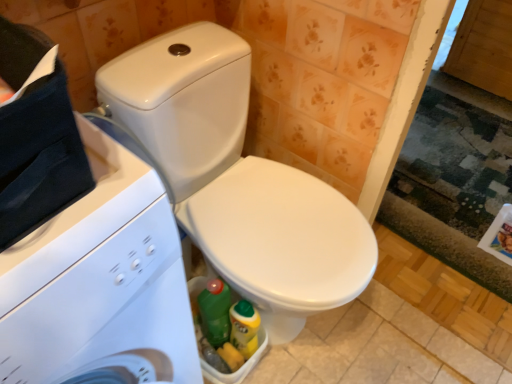
Question: Does point (146, 377) appear closer or farther from the camera than point (181, 137)?

Choices:
 (A) closer
 (B) farther

Answer: (A)

Question: In terms of size, does white glossy washing machine at left appear bigger or smaller than white glossy toilet at center?

Choices:
 (A) small
 (B) big

Answer: (A)

Question: Considering the positions of white glossy washing machine at left and white glossy toilet at center in the image, is white glossy washing machine at left taller or shorter than white glossy toilet at center?

Choices:
 (A) tall
 (B) short

Answer: (A)

Question: Considering the positions of white glossy toilet at center and white glossy washing machine at left in the image, is white glossy toilet at center taller or shorter than white glossy washing machine at left?

Choices:
 (A) tall
 (B) short

Answer: (B)

Question: From a real-world perspective, relative to white glossy washing machine at left, is white glossy toilet at center vertically above or below?

Choices:
 (A) above
 (B) below

Answer: (B)

Question: Is point (202, 104) positioned closer to the camera than point (22, 354)?

Choices:
 (A) closer
 (B) farther

Answer: (B)

Question: From the image's perspective, is white glossy toilet at center located above or below white glossy washing machine at left?

Choices:
 (A) below
 (B) above

Answer: (B)